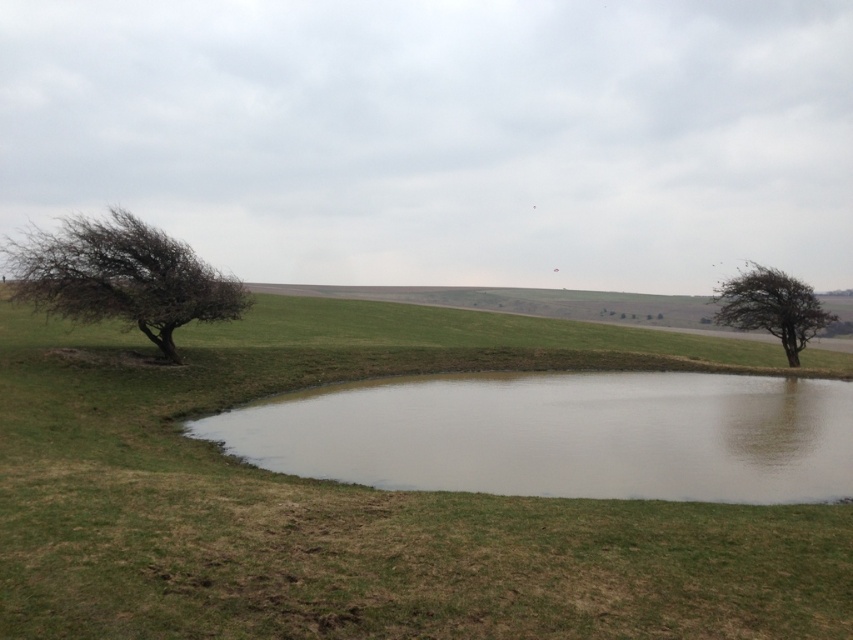
Measure the distance between point (379, 592) and camera.

Point (379, 592) and camera are 22.86 feet apart.

Image resolution: width=853 pixels, height=640 pixels. What are the coordinates of `green grassy at center` in the screenshot? It's located at (360, 499).

The image size is (853, 640). I want to click on green grassy at center, so click(360, 499).

Does brown rough tree at left appear on the right side of green leafy tree at right?

No, brown rough tree at left is not to the right of green leafy tree at right.

Who is shorter, brown rough tree at left or green leafy tree at right?

Standing shorter between the two is green leafy tree at right.

Is point (115, 298) farther from camera compared to point (810, 291)?

No, (115, 298) is in front of (810, 291).

The height and width of the screenshot is (640, 853). Find the location of `brown rough tree at left`. brown rough tree at left is located at coordinates (120, 276).

Between green grassy at center and brown rough tree at left, which one is positioned lower?

green grassy at center is lower down.

From the picture: Is green grassy at center closer to the viewer compared to brown rough tree at left?

Yes, green grassy at center is closer to the viewer.

What do you see at coordinates (360, 499) in the screenshot? The image size is (853, 640). I see `green grassy at center` at bounding box center [360, 499].

The image size is (853, 640). Find the location of `green grassy at center`. green grassy at center is located at coordinates (360, 499).